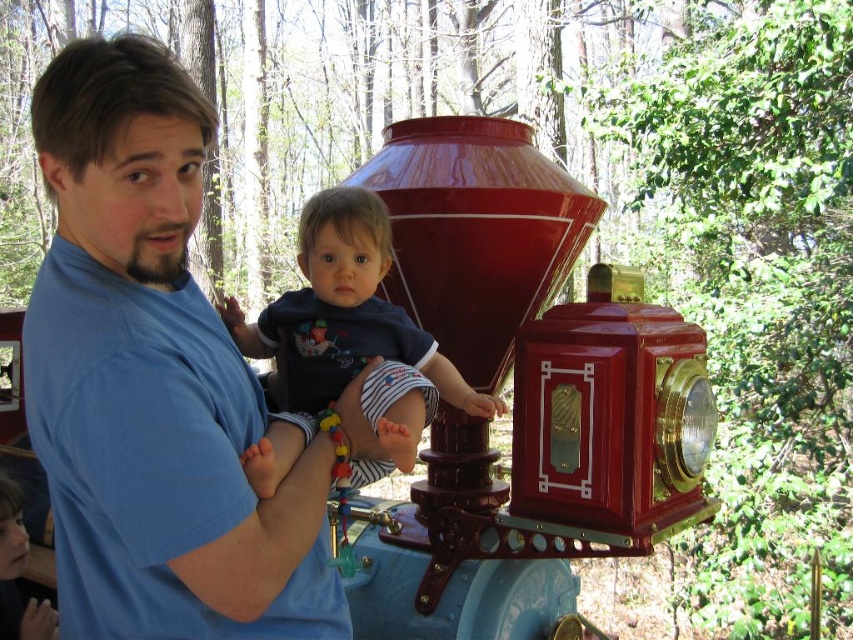
You are a photographer standing 2 meters away from the camera. You want to take a photo of the blue cotton shirt at center. Can you reach the shirt by moving forward without exceeding the 2.43 meters distance mentioned in the description?

The blue cotton shirt at center is 2.43 meters away from the camera. Since you are already 2 meters away from the camera, you can move forward an additional 0.43 meters to reach the shirt without exceeding the specified distance.